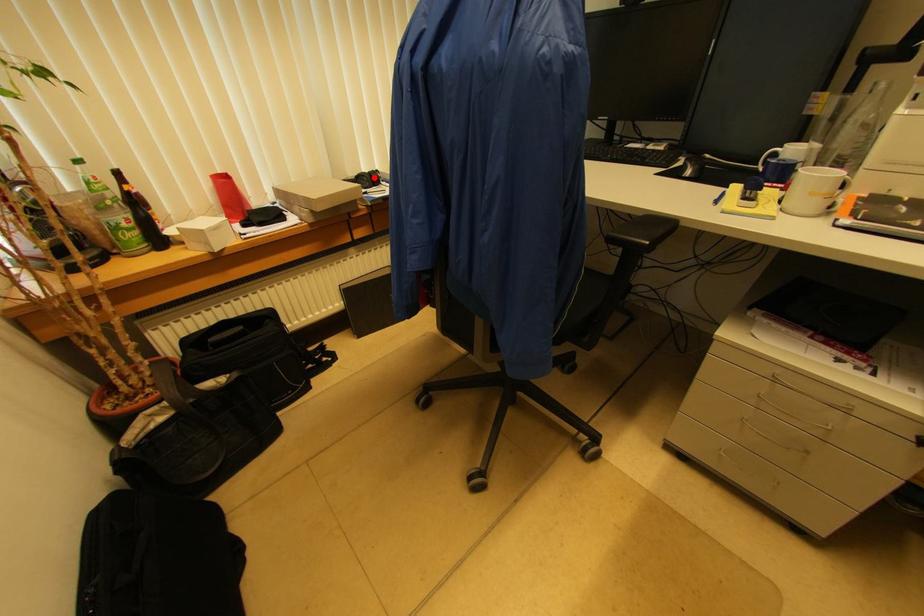
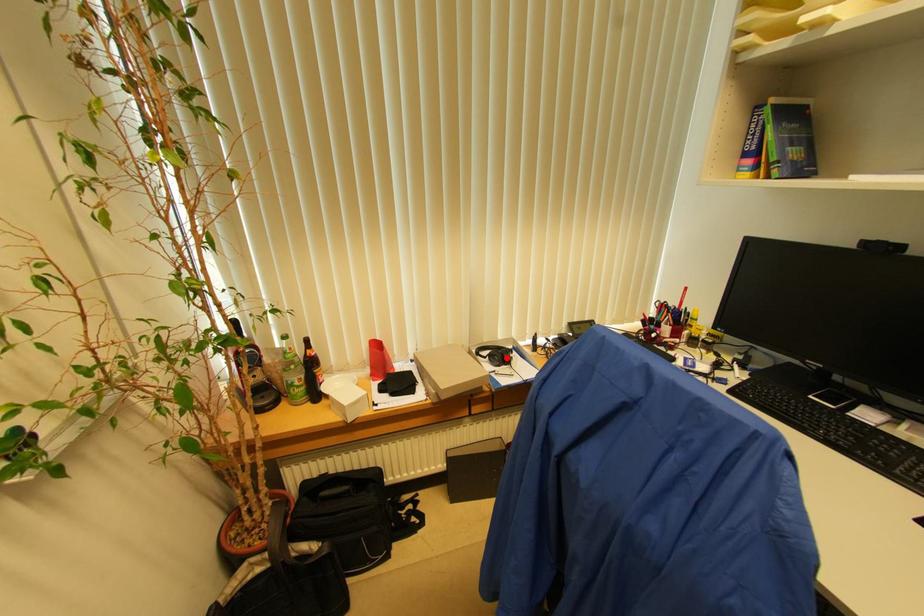
I am providing you with two images of the same scene from different viewpoints. A red point is marked on the first image and another point is marked on the second image. Are the points marked in image1 and image2 representing the same 3D position?

Yes